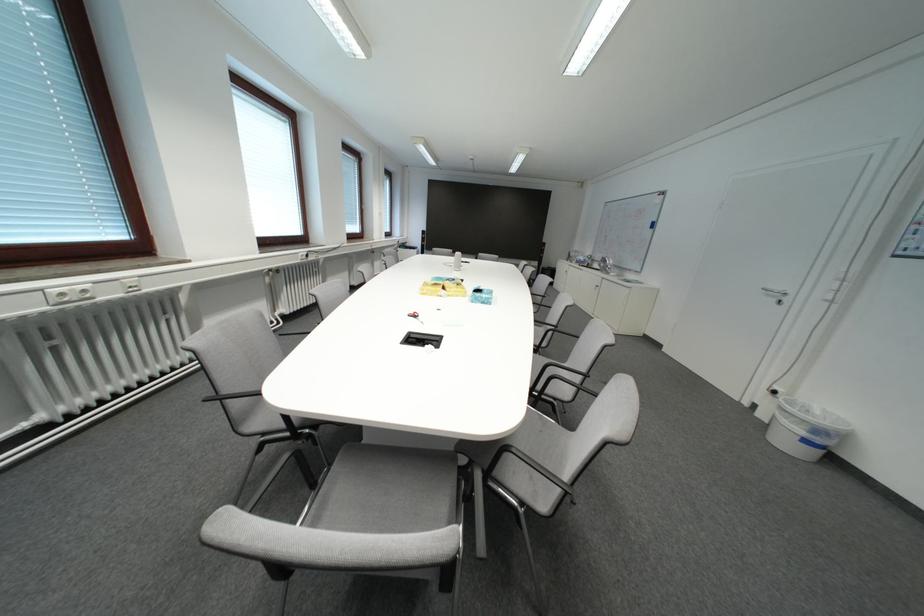
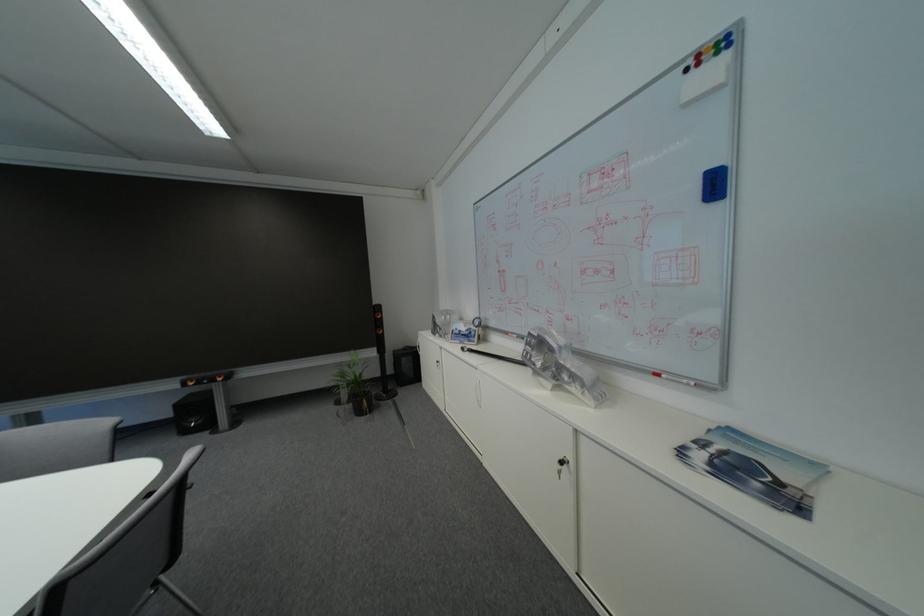
The point at (x=673, y=192) is marked in the first image. Where is the corresponding point in the second image?

(723, 34)